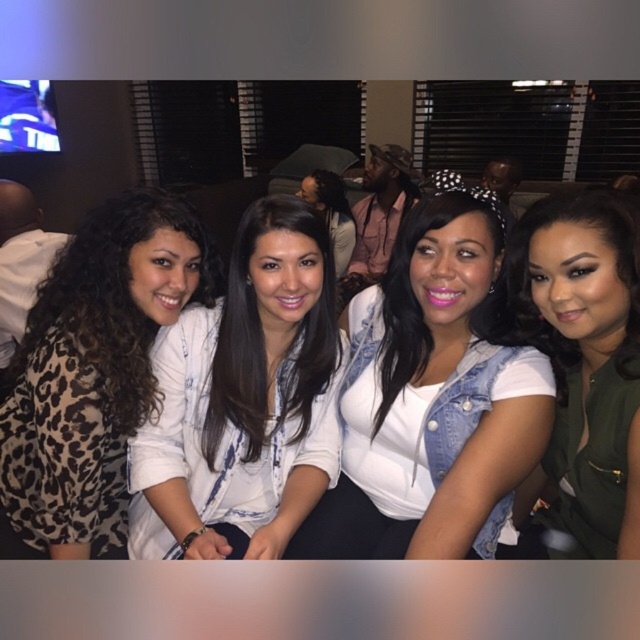
You are a photographer trying to adjust the lighting for a group photo. You notice the denim jacket at center and the white printed shirt at center are overlapping. Which clothing item is blocking the light from reaching the other?

The denim jacket at center is in front of the white printed shirt at center, so the denim jacket is blocking the light from reaching the white printed shirt.

Consider the image. You are a photographer trying to capture a clear shot of both the leopard print top at left and the green matte vest at center. Which one should you focus on first to ensure both are in focus?

The leopard print top at left is further to the viewer than the green matte vest at center, so focus on the leopard print top at left first. This way, the green matte vest at center will be in focus as well since it is behind it.

You are standing at point (468,240) and want to reach the television screen on the left. Can you walk straight ahead? Explain why or why not based on the distance between you and the television screen.

The distance between you and the television screen is 1.08 meters. Since the path is clear and there are no obstacles mentioned, you can walk straight ahead to reach the television screen.